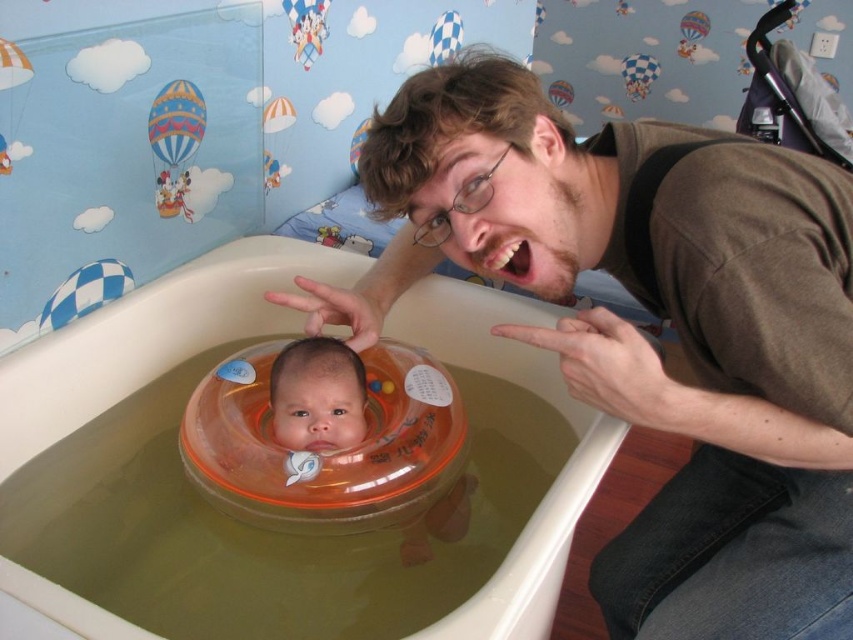
You are designing a layout for a baby shower invitation. The invitation has limited space. You need to place the brown cotton shirt at upper right and the blue checkered float at upper left. Which object should you scale down to ensure both fit without overlapping?

The brown cotton shirt at upper right might be wider than the blue checkered float at upper left, so scaling down the brown cotton shirt at upper right would ensure both fit without overlapping.

You are a parent preparing to bathe your baby. You have two floats in the tub, the smooth orange float at center and the blue checkered float at upper left. Which float should you choose if you want the one that can provide more support due to its size?

The smooth orange float at center is larger in size than the blue checkered float at upper left, so you should choose the smooth orange float at center for more support.

You are a parent trying to locate two points in the baby bathtub scene. The first point is at coordinates point (339, 413) and the second is at point (194, 134). Which point is closer to the baby?

Point (339, 413) is in front of point (194, 134), so it is closer to the baby.